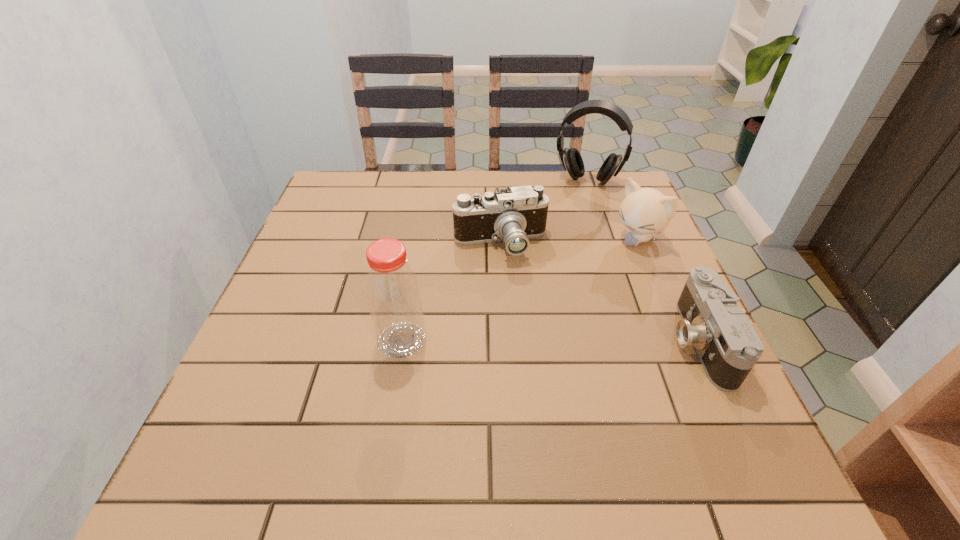
This screenshot has width=960, height=540. I want to click on free space between the kitten and the shorter camera, so click(668, 290).

Select which object is the closest to the leftmost object. Please provide its 2D coordinates. Your answer should be formatted as a tuple, i.e. [(x, y)], where the tuple contains the x and y coordinates of a point satisfying the conditions above.

[(514, 214)]

Find the location of a particular element. object that is the third closest to the shorter camera is located at coordinates (571, 159).

Where is `free space that satisfies the following two spatial constraints: 1. on the front side of the bottle; 2. on the lens of the nearer camera`? This screenshot has width=960, height=540. free space that satisfies the following two spatial constraints: 1. on the front side of the bottle; 2. on the lens of the nearer camera is located at coordinates (402, 341).

Where is `vacant space that satisfies the following two spatial constraints: 1. on the back side of the left camera; 2. on the right side of the farthest object`? The width and height of the screenshot is (960, 540). vacant space that satisfies the following two spatial constraints: 1. on the back side of the left camera; 2. on the right side of the farthest object is located at coordinates (497, 181).

Locate an element on the screen. The width and height of the screenshot is (960, 540). vacant space that satisfies the following two spatial constraints: 1. on the front side of the fourth object from right to left; 2. on the lens of the shorter camera is located at coordinates (506, 341).

Identify the location of free spot that satisfies the following two spatial constraints: 1. on the front side of the kitten; 2. on the lens of the right camera. (680, 341).